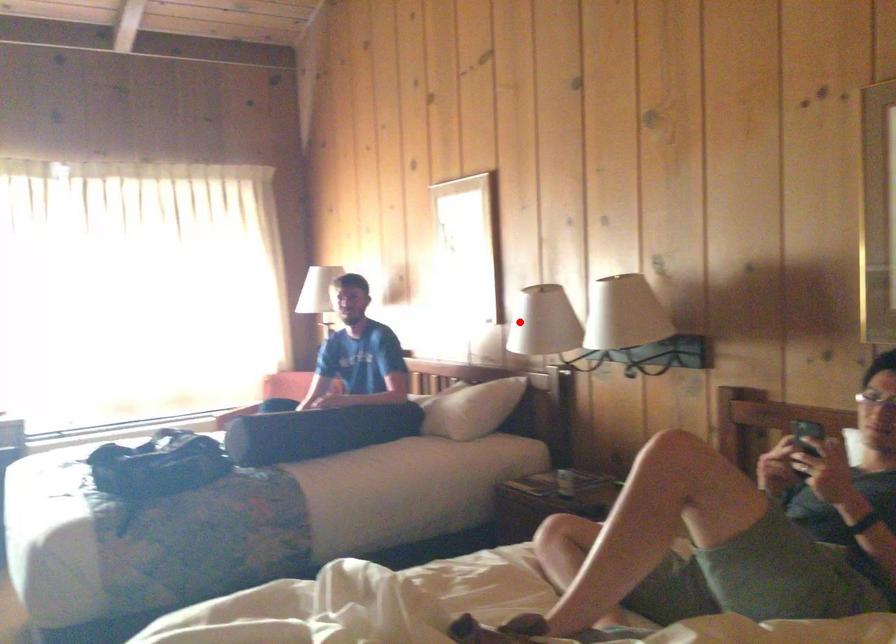
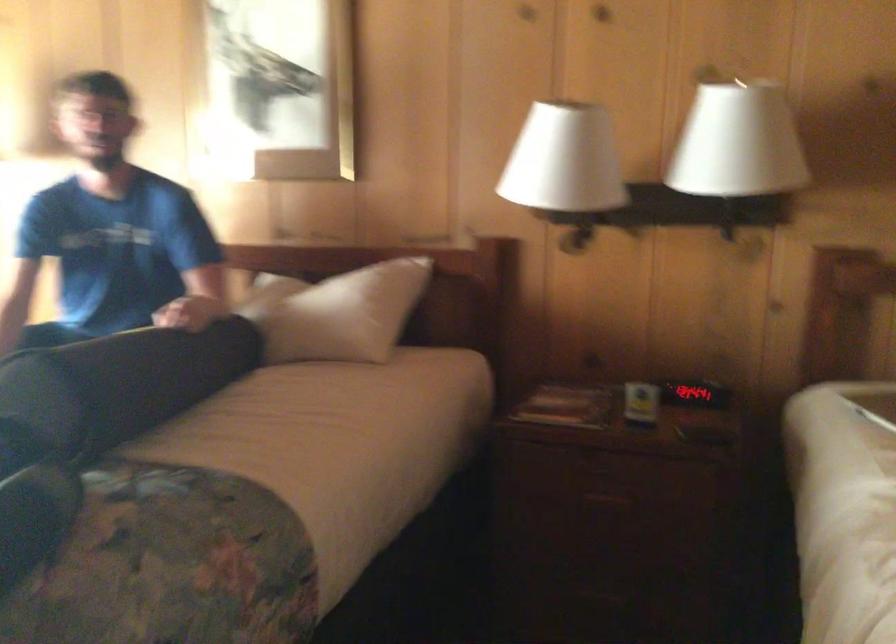
Question: A red point is marked in image1. In image2, is the corresponding 3D point closer to the camera or farther? Reply with the corresponding letter.

Choices:
 (A) The corresponding 3D point is closer.
 (B) The corresponding 3D point is farther.

Answer: (A)